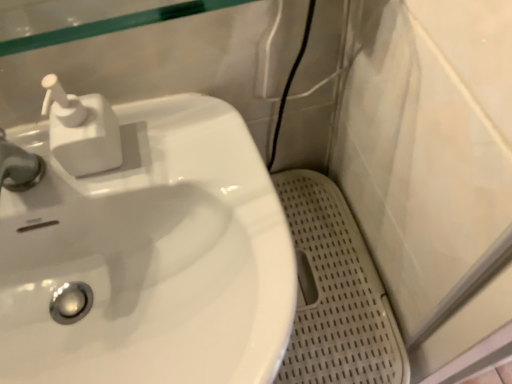
Question: Does white glossy sink at left have a lesser width compared to white perforated mat at lower right?

Choices:
 (A) yes
 (B) no

Answer: (B)

Question: Can you confirm if white glossy sink at left is taller than white perforated mat at lower right?

Choices:
 (A) yes
 (B) no

Answer: (B)

Question: Is white glossy sink at left positioned with its back to white perforated mat at lower right?

Choices:
 (A) yes
 (B) no

Answer: (B)

Question: Is white glossy sink at left at the left side of white perforated mat at lower right?

Choices:
 (A) yes
 (B) no

Answer: (A)

Question: Does white glossy sink at left have a smaller size compared to white perforated mat at lower right?

Choices:
 (A) yes
 (B) no

Answer: (B)

Question: Is the position of white glossy sink at left less distant than that of white perforated mat at lower right?

Choices:
 (A) no
 (B) yes

Answer: (B)

Question: Can white glossy sink at left be found inside white perforated mat at lower right?

Choices:
 (A) no
 (B) yes

Answer: (A)

Question: Can you confirm if white perforated mat at lower right is bigger than white glossy sink at left?

Choices:
 (A) no
 (B) yes

Answer: (A)

Question: Is white perforated mat at lower right turned away from white glossy sink at left?

Choices:
 (A) yes
 (B) no

Answer: (B)

Question: Does white perforated mat at lower right lie in front of white glossy sink at left?

Choices:
 (A) yes
 (B) no

Answer: (B)

Question: Considering the relative sizes of white perforated mat at lower right and white glossy sink at left in the image provided, is white perforated mat at lower right shorter than white glossy sink at left?

Choices:
 (A) yes
 (B) no

Answer: (B)

Question: Does white perforated mat at lower right have a lesser width compared to white glossy sink at left?

Choices:
 (A) no
 (B) yes

Answer: (B)

Question: From a real-world perspective, does white plastic soap dispenser at upper left sit lower than white perforated mat at lower right?

Choices:
 (A) yes
 (B) no

Answer: (B)